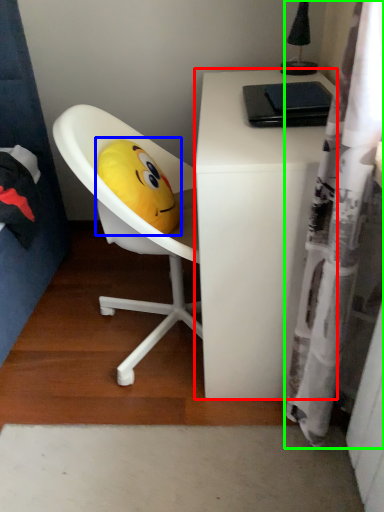
Question: Estimate the real-world distances between objects in this image. Which object is farther from desk (highlighted by a red box), toy (highlighted by a blue box) or shower curtain (highlighted by a green box)?

Choices:
 (A) toy
 (B) shower curtain

Answer: (A)